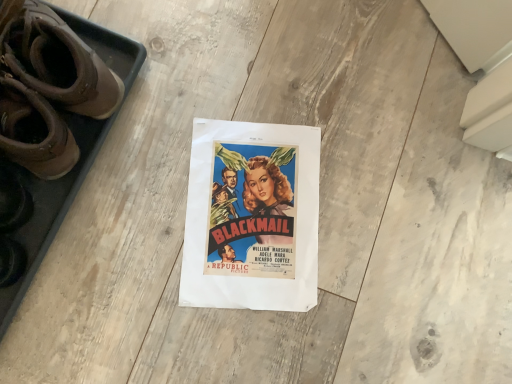
Identify the location of free space above matte paper poster at center (from a real-world perspective). (254, 215).